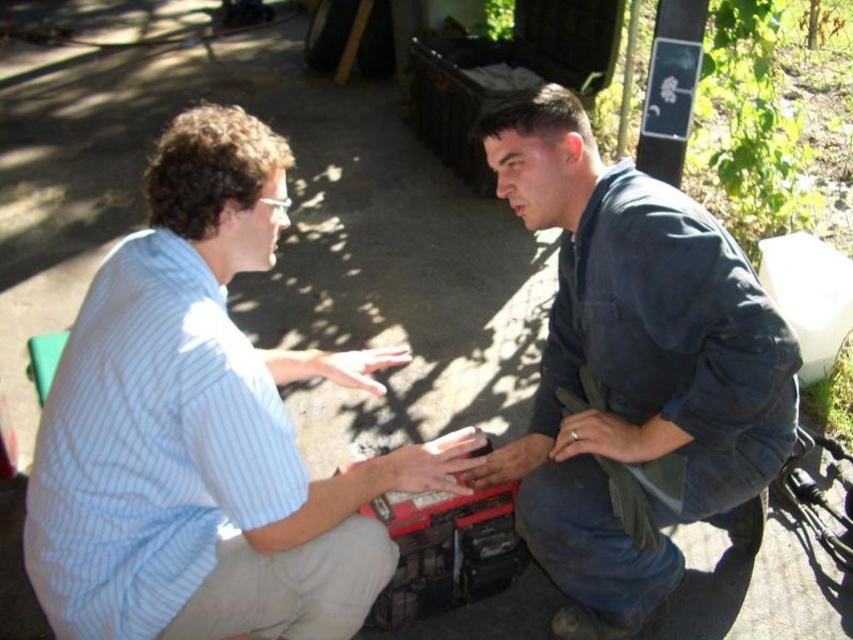
Question: Does light blue striped shirt at center appear on the right side of dark blue denim jeans at center?

Choices:
 (A) no
 (B) yes

Answer: (A)

Question: Does light blue striped shirt at center appear on the left side of dark blue denim jeans at center?

Choices:
 (A) yes
 (B) no

Answer: (A)

Question: Which of the following is the farthest from the observer?

Choices:
 (A) (627, 340)
 (B) (239, 339)

Answer: (A)

Question: Which of the following is the closest to the observer?

Choices:
 (A) dark blue denim jeans at center
 (B) light blue striped shirt at center

Answer: (B)

Question: Is light blue striped shirt at center smaller than dark blue denim jeans at center?

Choices:
 (A) no
 (B) yes

Answer: (B)